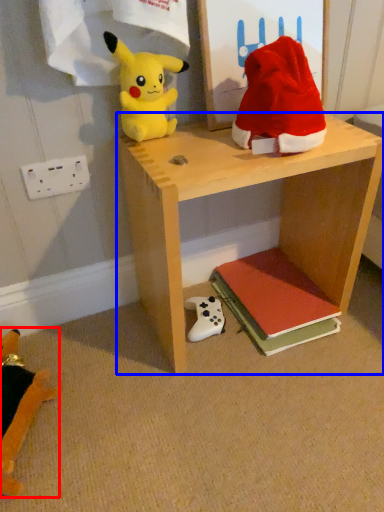
Question: Which point is closer to the camera, toy (highlighted by a red box) or shelf (highlighted by a blue box)?

Choices:
 (A) toy
 (B) shelf

Answer: (B)